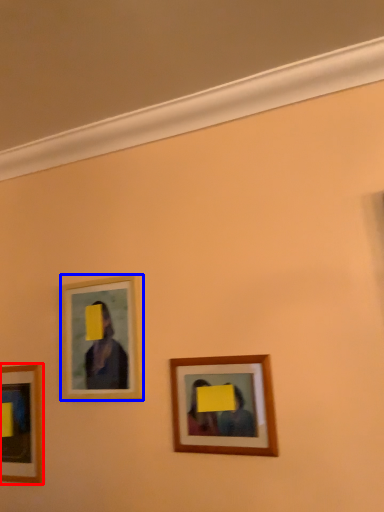
Question: Which point is closer to the camera, picture frame (highlighted by a red box) or picture frame (highlighted by a blue box)?

Choices:
 (A) picture frame
 (B) picture frame

Answer: (B)